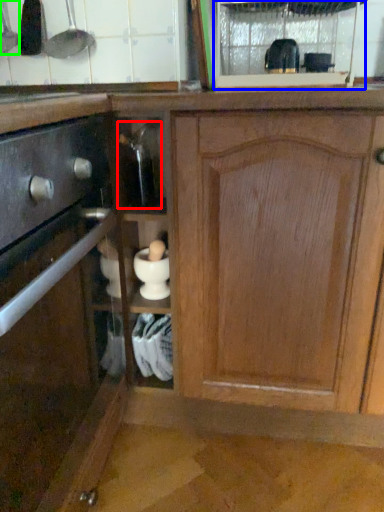
Question: Estimate the real-world distances between objects in this image. Which object is farther from appliance (highlighted by a red box), glass door (highlighted by a blue box) or appliance (highlighted by a green box)?

Choices:
 (A) glass door
 (B) appliance

Answer: (A)